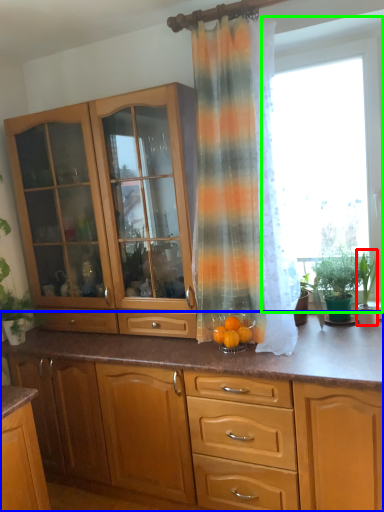
Question: Based on their relative distances, which object is nearer to houseplant (highlighted by a red box)? Choose from cabinetry (highlighted by a blue box) and window screen (highlighted by a green box).

Choices:
 (A) cabinetry
 (B) window screen

Answer: (B)